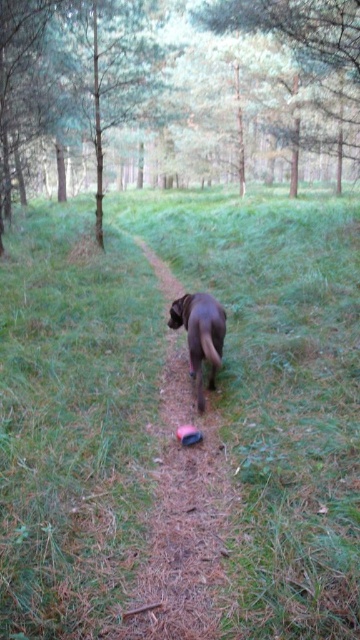
Between brown fur dog at center and brown matte dog at center, which one appears on the right side from the viewer's perspective?

brown matte dog at center

Does brown fur dog at center have a greater height compared to brown matte dog at center?

No.

I want to click on brown fur dog at center, so click(182, 522).

Does point (20, 534) lie in front of point (164, 401)?

Yes, point (20, 534) is in front of point (164, 401).

Who is shorter, green grassy at center or brown fur dog at center?

brown fur dog at center

What do you see at coordinates (281, 388) in the screenshot? This screenshot has height=640, width=360. I see `green grassy at center` at bounding box center [281, 388].

Locate an element on the screen. green grassy at center is located at coordinates (281, 388).

Is point (65, 314) farther from camera compared to point (187, 340)?

Yes, it is.

Describe the element at coordinates (281, 388) in the screenshot. I see `green grassy at center` at that location.

This screenshot has height=640, width=360. In order to click on green grassy at center in this screenshot , I will do pyautogui.click(x=281, y=388).